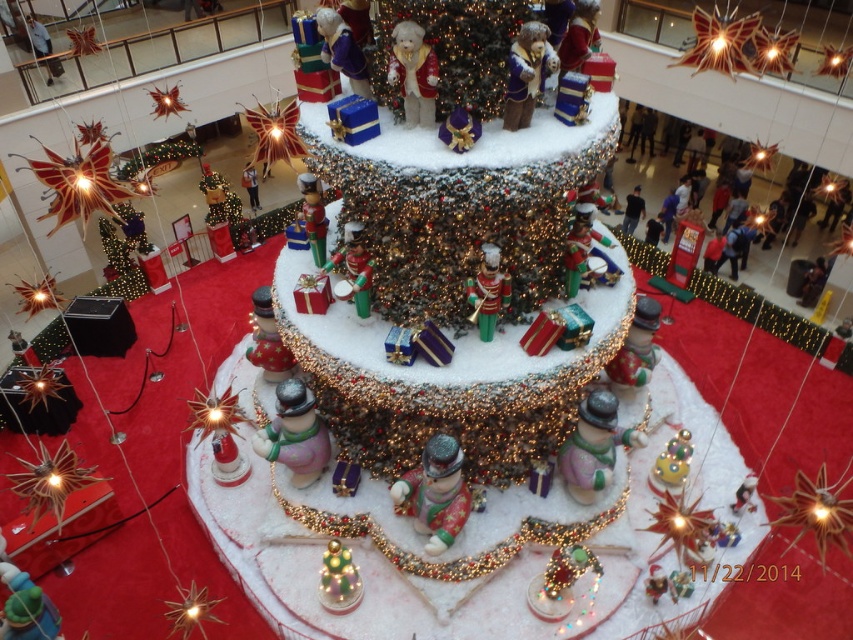
You are a visitor at the mall and want to take a photo of the frosted glass christmas tree at center and the matte gold figurine at upper center. Which one should you focus on first if you want to capture both in the same frame without moving your camera?

The frosted glass christmas tree at center is located above the matte gold figurine at upper center, so you should focus on the matte gold figurine at upper center first as it is lower in the frame to ensure both are in the same shot.

You are a holiday shopper who wants to take a photo of both the frosted glass christmas tree at center and the matte gold figurine at upper center. Since you want both in the frame, which object should you focus on to ensure both are visible?

You should focus on the frosted glass christmas tree at center because it is larger than the matte gold figurine at upper center, so it will be easier to capture both in the frame by centering the larger object.

You are a visitor standing in front of the Christmas display. You want to take a photo of the frosted glass christmas tree at center and the matte gold figurine at upper center. Which object will appear larger in your photo?

The frosted glass christmas tree at center will appear larger in the photo because it is closer to the viewer than the matte gold figurine at upper center.